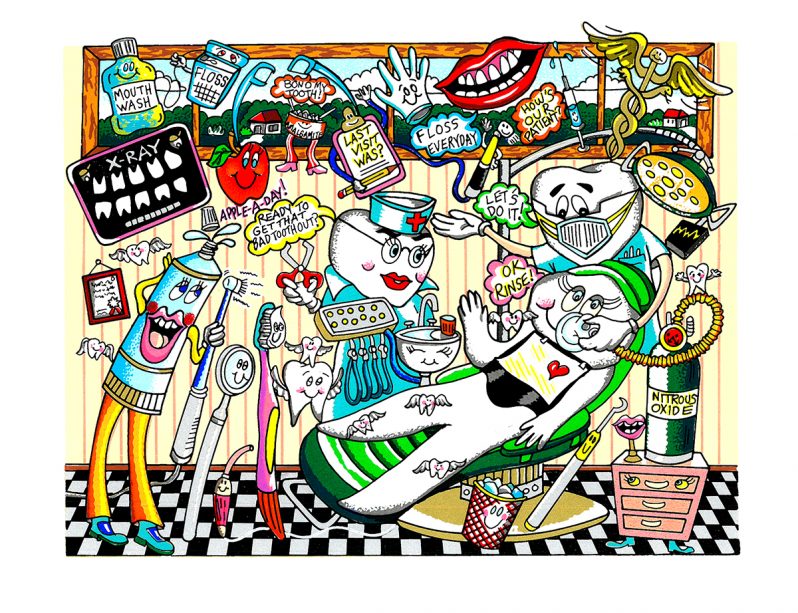
At what (x,y) coordinates should I click in order to perform the action: click on wall. Please return your answer as a coordinate pair (x, y). Looking at the image, I should click on (77, 420).